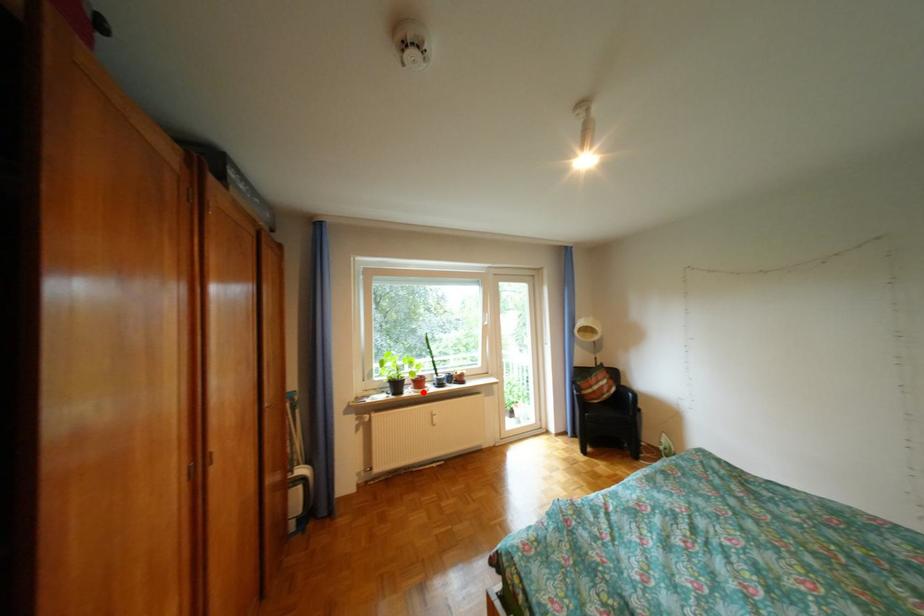
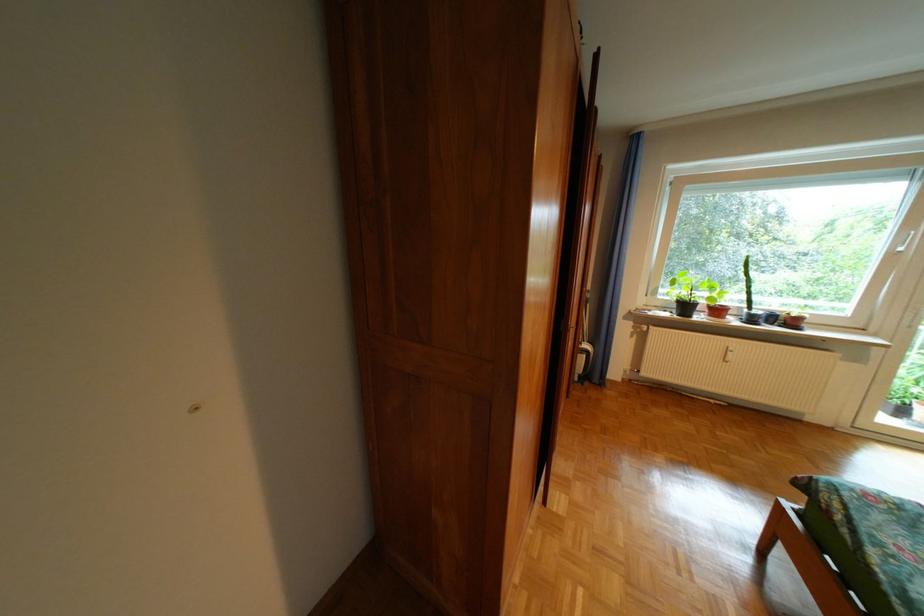
Question: I am providing you with two images of the same scene from different viewpoints. Image1 has a red point marked. In image2, the corresponding 3D location appears at what relative position? Reply with the corresponding letter.

Choices:
 (A) Closer
 (B) Farther

Answer: (A)